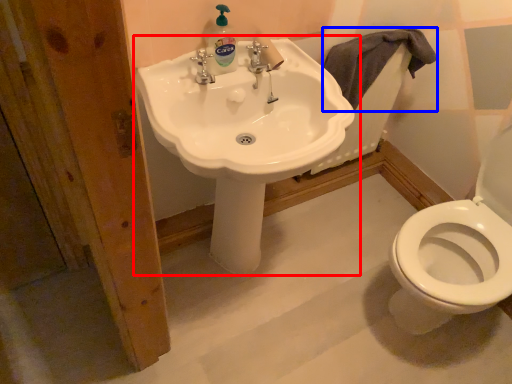
Question: Which point is closer to the camera, sink (highlighted by a red box) or bath towel (highlighted by a blue box)?

Choices:
 (A) sink
 (B) bath towel

Answer: (A)